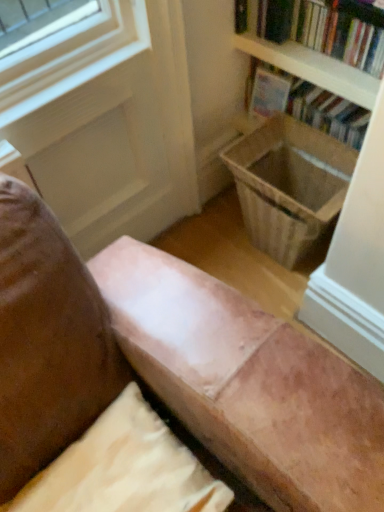
Question: Is hardcover book at upper right, which appears as the 2th book when viewed from the back, taller or shorter than hardcover book at upper right, the 1th book in the back-to-front sequence?

Choices:
 (A) tall
 (B) short

Answer: (B)

Question: Relative to hardcover book at upper right, the 1th book in the back-to-front sequence, is hardcover book at upper right, which appears as the 2th book when viewed from the back, in front or behind?

Choices:
 (A) behind
 (B) front

Answer: (B)

Question: Based on their relative distances, which object is nearer to the hardcover book at upper right, the 1th book in the back-to-front sequence?

Choices:
 (A) wooden laundry basket at lower right
 (B) suede-like beige pillow at lower center
 (C) hardcover book at upper right, which appears as the 2th book when viewed from the back

Answer: (C)

Question: Which object is the farthest from the suede-like beige pillow at lower center?

Choices:
 (A) hardcover book at upper right, the 2th book from the front
 (B) hardcover book at upper right, which appears as the 2th book when viewed from the back
 (C) wooden laundry basket at lower right

Answer: (B)